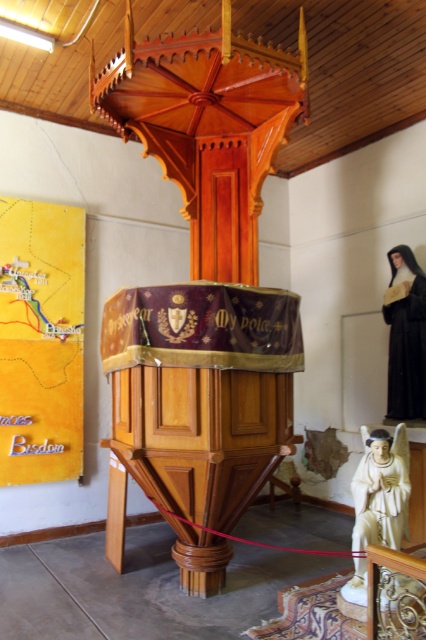
Does white marble statue at lower right have a larger size compared to dark brown woolen robe at right?

No.

Describe the element at coordinates (382, 490) in the screenshot. I see `white marble statue at lower right` at that location.

What are the coordinates of `white marble statue at lower right` in the screenshot? It's located at (382, 490).